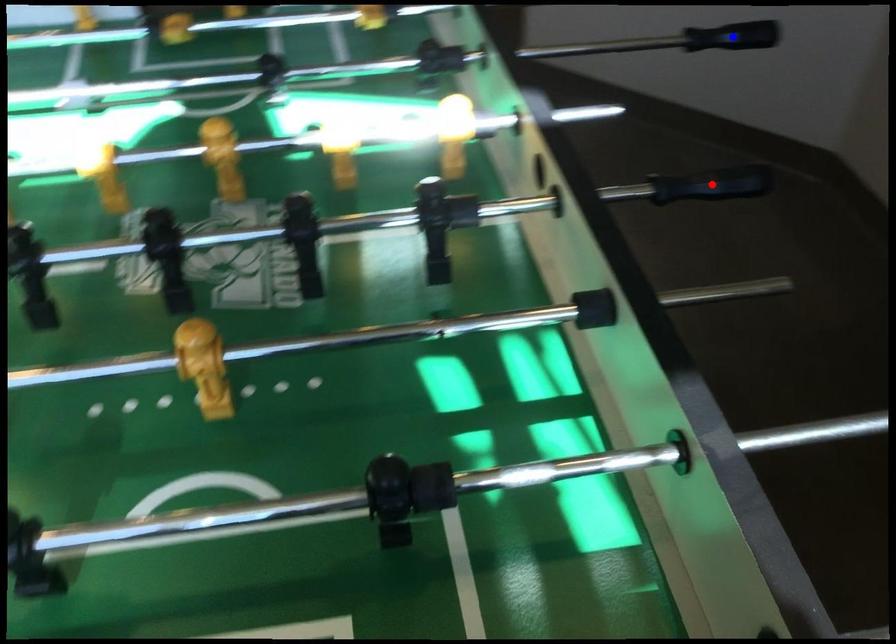
Question: Which of the two points in the image is closer to the camera?

Choices:
 (A) Blue point is closer.
 (B) Red point is closer.

Answer: (B)